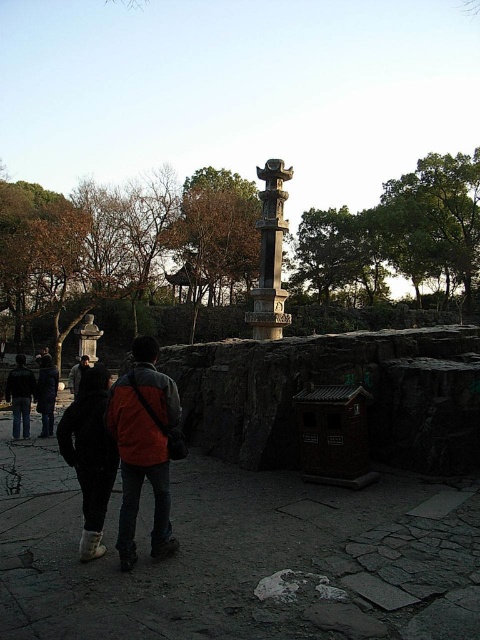
Which of these two, dark gray jeans at center or polished stone monument at center, stands taller?

polished stone monument at center

Who is lower down, dark gray jeans at center or polished stone monument at center?

dark gray jeans at center is below.

Which is behind, point (86, 422) or point (282, 164)?

Positioned behind is point (282, 164).

You are a GUI agent. You are given a task and a screenshot of the screen. Output one action in this format:
    pyautogui.click(x=<x>, y=<y>)
    Task: Click on the dark gray jeans at center
    
    Given the screenshot: What is the action you would take?
    pyautogui.click(x=90, y=454)

Can you confirm if dark gray jeans at center is shorter than jeans at center?

Correct, dark gray jeans at center is not as tall as jeans at center.

Who is positioned more to the left, dark gray jeans at center or jeans at center?

Positioned to the left is jeans at center.

Between point (67, 456) and point (26, 410), which one is positioned in front?

Positioned in front is point (67, 456).

Where is `dark gray jeans at center`? The width and height of the screenshot is (480, 640). dark gray jeans at center is located at coordinates (90, 454).

Is polished stone monument at center shorter than jeans at center?

In fact, polished stone monument at center may be taller than jeans at center.

Is polished stone monument at center closer to camera compared to jeans at center?

No.

Consider the image. Who is more forward, [279,177] or [13,388]?

Positioned in front is point [13,388].

Locate an element on the screen. polished stone monument at center is located at coordinates (271, 253).